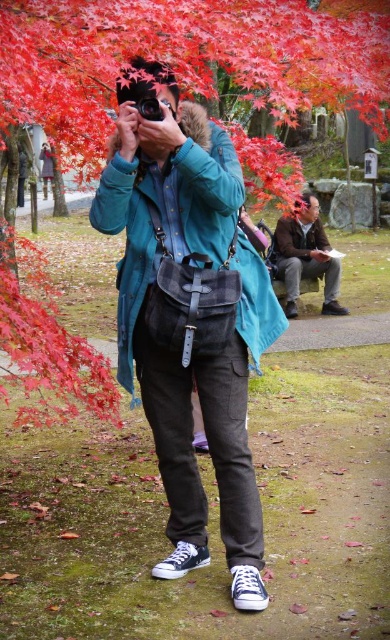
You are a photographer trying to capture the shiny red maple leaf at upper left in your frame. Your current camera, the matte black camera at center, is positioned to the right of the leaf. Can you adjust your camera position to include both the leaf and the person taking the photo?

The matte black camera at center is positioned to the right of the shiny red maple leaf at upper left. To include both the leaf and the person in the frame, you would need to move the camera to the left so it is aligned with the leaf while still capturing the person.

You are a photographer trying to capture the scene with your camera. The camera has a built in GPS. You want to know the 2D coordinates of the brown leather jacket at lower right. What are they?

The 2D coordinates of the brown leather jacket at lower right are at point (306, 257).

You are a photographer carrying a black leather camera at center and a brown leather jacket at lower right. You want to take a photo of the maple trees without any obstructions. Which item should you move first to ensure the camera has a clear view?

The brown leather jacket at lower right is closer to you than the black leather camera at center, so you should move the brown leather jacket at lower right first to ensure the camera has a clear view.